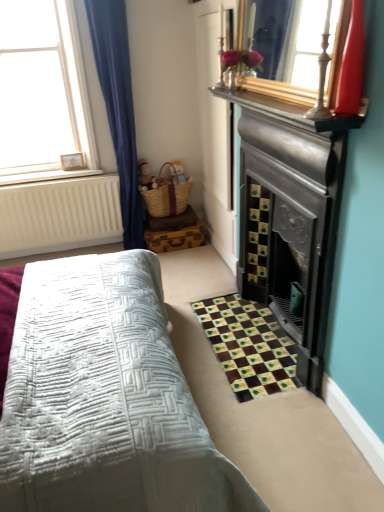
Question: Is shiny red glass vase at upper right surrounding wooden picture frame at upper left?

Choices:
 (A) yes
 (B) no

Answer: (B)

Question: From a real-world perspective, does shiny red glass vase at upper right stand above wooden picture frame at upper left?

Choices:
 (A) yes
 (B) no

Answer: (A)

Question: Is shiny red glass vase at upper right positioned before wooden picture frame at upper left?

Choices:
 (A) yes
 (B) no

Answer: (A)

Question: Can we say shiny red glass vase at upper right lies outside wooden picture frame at upper left?

Choices:
 (A) no
 (B) yes

Answer: (B)

Question: Does shiny red glass vase at upper right have a greater width compared to wooden picture frame at upper left?

Choices:
 (A) yes
 (B) no

Answer: (A)

Question: Is shiny red glass vase at upper right at the right side of wooden picture frame at upper left?

Choices:
 (A) yes
 (B) no

Answer: (A)

Question: Is white wooden frame at upper left taller than wooden picture frame at upper left?

Choices:
 (A) no
 (B) yes

Answer: (B)

Question: From the image's perspective, is white wooden frame at upper left under wooden picture frame at upper left?

Choices:
 (A) yes
 (B) no

Answer: (B)

Question: Is white wooden frame at upper left closer to camera compared to wooden picture frame at upper left?

Choices:
 (A) no
 (B) yes

Answer: (B)

Question: Considering the relative sizes of white wooden frame at upper left and wooden picture frame at upper left in the image provided, is white wooden frame at upper left wider than wooden picture frame at upper left?

Choices:
 (A) yes
 (B) no

Answer: (A)

Question: Is white wooden frame at upper left directly adjacent to wooden picture frame at upper left?

Choices:
 (A) no
 (B) yes

Answer: (A)

Question: Is wooden picture frame at upper left located within white wooden frame at upper left?

Choices:
 (A) no
 (B) yes

Answer: (B)

Question: Can you confirm if white wooden frame at upper left is wider than shiny red glass vase at upper right?

Choices:
 (A) no
 (B) yes

Answer: (B)